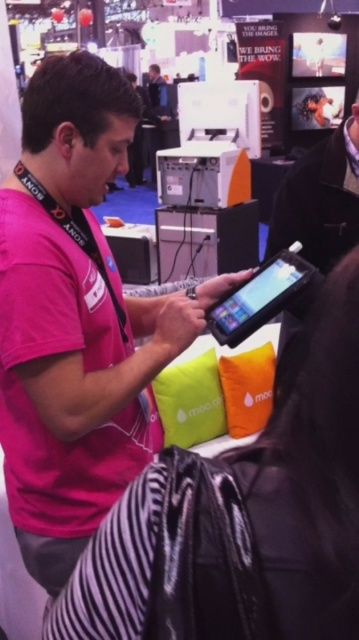
You are a photographer at the exhibition and need to take a clear photo of the matte black tablet at center without any obstruction. The pink matte shirt at center is currently blocking the view. Can you adjust your position to capture the tablet without the shirt covering it?

The pink matte shirt at center is positioned over the matte black tablet at center, so moving your camera angle slightly downward might allow you to capture the tablet without the shirt obstructing the view.